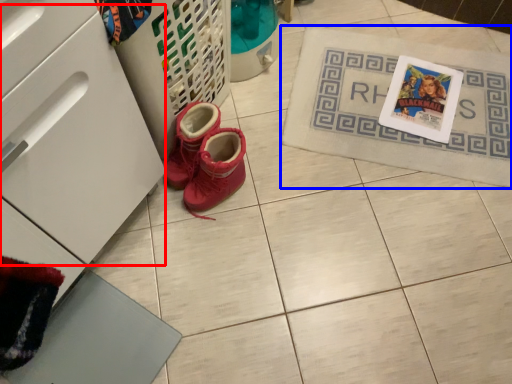
Question: Which object appears closest to the camera in this image, drawer (highlighted by a red box) or bath mat (highlighted by a blue box)?

Choices:
 (A) drawer
 (B) bath mat

Answer: (A)